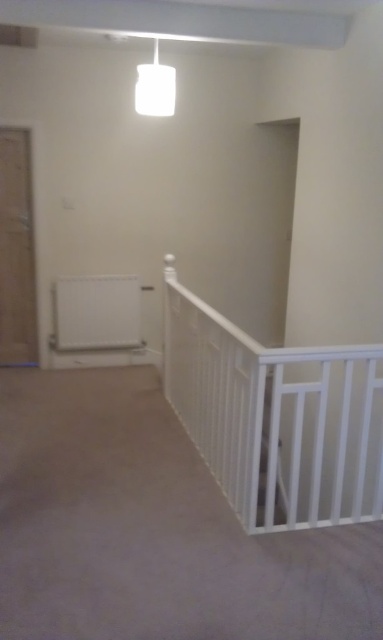
Question: Which of the following is the farthest from the observer?

Choices:
 (A) white wooden rail at center
 (B) white glossy pendant light at upper center

Answer: (B)

Question: Is white wooden rail at center positioned before white wooden stair at center?

Choices:
 (A) no
 (B) yes

Answer: (A)

Question: Estimate the real-world distances between objects in this image. Which object is farther from the white wooden stair at center?

Choices:
 (A) wooden door at left
 (B) white glossy pendant light at upper center
 (C) white wooden rail at center

Answer: (A)

Question: Is white wooden rail at center bigger than wooden door at left?

Choices:
 (A) no
 (B) yes

Answer: (B)

Question: Is white wooden rail at center bigger than white glossy pendant light at upper center?

Choices:
 (A) yes
 (B) no

Answer: (A)

Question: Estimate the real-world distances between objects in this image. Which object is closer to the white glossy pendant light at upper center?

Choices:
 (A) white wooden rail at center
 (B) white wooden stair at center

Answer: (A)